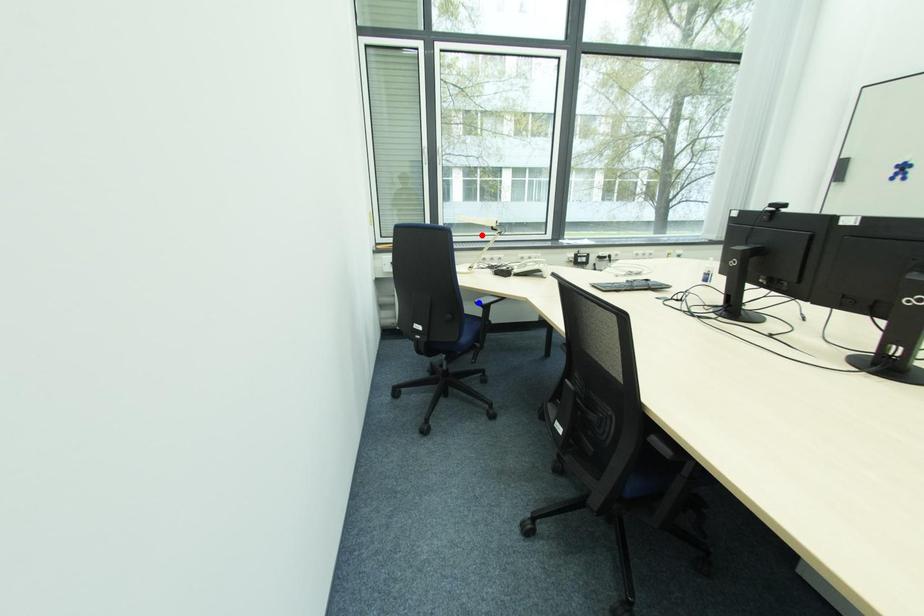
Question: Two points are marked on the image. Which point is closer to the camera?

Choices:
 (A) Blue point is closer.
 (B) Red point is closer.

Answer: (A)